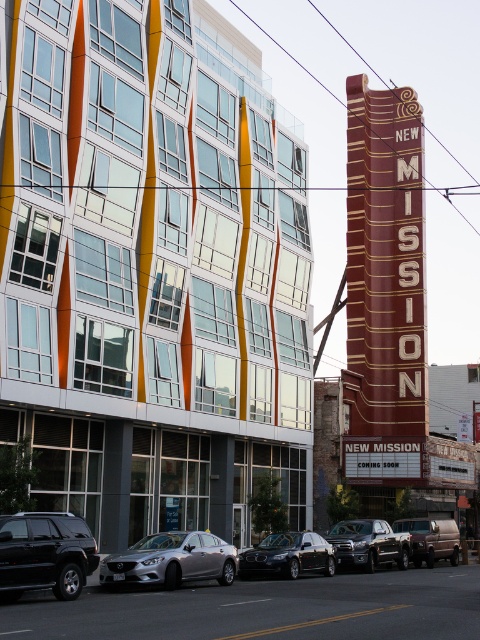
Question: Considering the relative positions of brown/marble-like sign at upper center and shiny black suv at lower left in the image provided, where is brown/marble-like sign at upper center located with respect to shiny black suv at lower left?

Choices:
 (A) left
 (B) right

Answer: (B)

Question: Does shiny black suv at lower left have a lesser width compared to matte black truck at center?

Choices:
 (A) no
 (B) yes

Answer: (B)

Question: Which point is closer to the camera taking this photo?

Choices:
 (A) (364, 529)
 (B) (432, 522)
 (C) (402, 412)
 (D) (153, 54)

Answer: (A)

Question: Which point is farther to the camera?

Choices:
 (A) silver metallic sedan at center
 (B) shiny black sedan at center
 (C) glassy reflective building at center
 (D) metallic silver van at center

Answer: (D)

Question: Can you confirm if silver metallic sedan at center is positioned to the left of matte black truck at center?

Choices:
 (A) yes
 (B) no

Answer: (A)

Question: Which of the following is the farthest from the observer?

Choices:
 (A) (162, 556)
 (B) (396, 525)
 (C) (14, 554)
 (D) (340, 547)

Answer: (B)